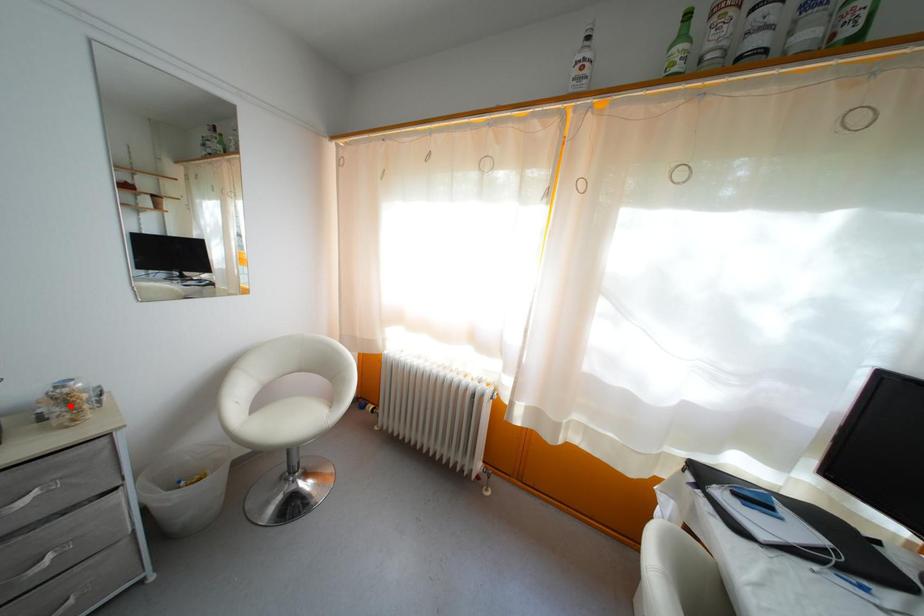
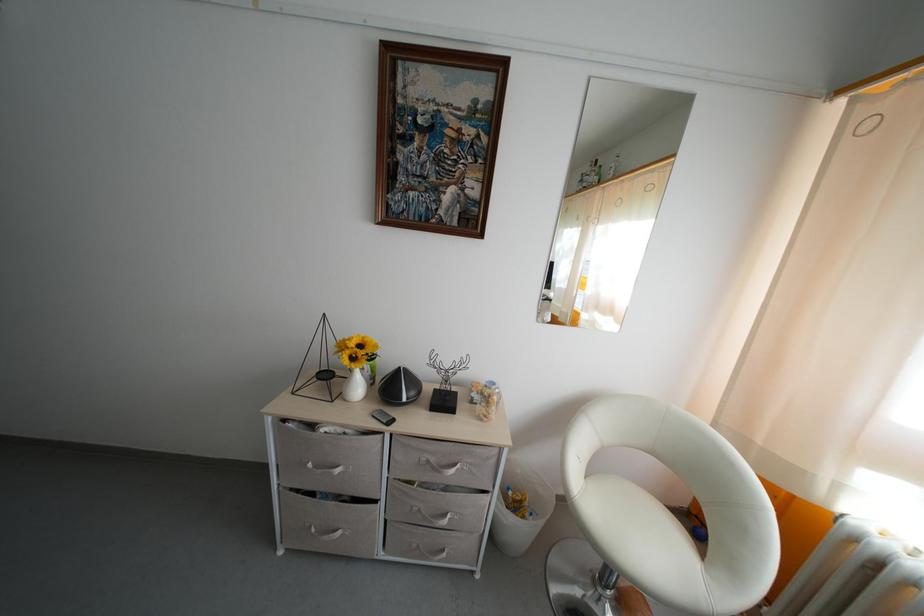
The point at the highlighted location is marked in the first image. Where is the corresponding point in the second image?

(493, 406)